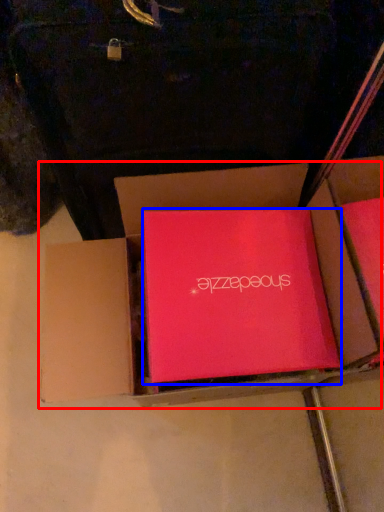
Question: Which object is closer to the camera taking this photo, box (highlighted by a red box) or box (highlighted by a blue box)?

Choices:
 (A) box
 (B) box

Answer: (A)